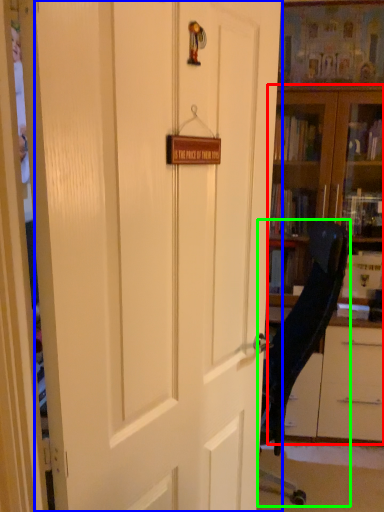
Question: Considering the real-world distances, which object is farthest from bookcase (highlighted by a red box)? door (highlighted by a blue box) or chair (highlighted by a green box)?

Choices:
 (A) door
 (B) chair

Answer: (A)